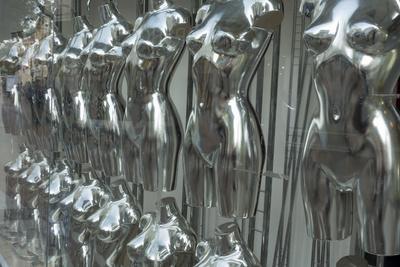
At what (x,y) coordinates should I click in order to perform the action: click on wall. Please return your answer as a coordinate pair (x, y). Image resolution: width=400 pixels, height=267 pixels. Looking at the image, I should click on (8, 11), (8, 148), (285, 58), (180, 87), (128, 9).